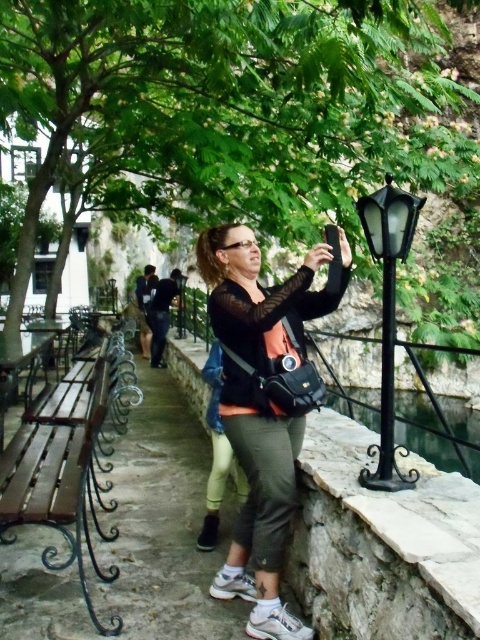
Is green fabric pants at center in front of black wrought iron lamp post at right?

Yes.

Measure the distance from green fabric pants at center to black wrought iron lamp post at right.

A distance of 1.67 meters exists between green fabric pants at center and black wrought iron lamp post at right.

Between point (2, 600) and point (408, 205), which one is positioned behind?

Point (2, 600)

Image resolution: width=480 pixels, height=640 pixels. I want to click on green fabric pants at center, so click(x=163, y=525).

Between wooden bench at left and black wrought iron lamp post at right, which one has more height?

wooden bench at left

Between wooden bench at left and black wrought iron lamp post at right, which one appears on the left side from the viewer's perspective?

Positioned to the left is wooden bench at left.

Does point (133, 388) come closer to viewer compared to point (391, 433)?

No, (133, 388) is behind (391, 433).

The image size is (480, 640). I want to click on wooden bench at left, so click(66, 461).

In the scene shown: Is green leafy tree at upper center shorter than matte black camera at center?

In fact, green leafy tree at upper center may be taller than matte black camera at center.

Is green leafy tree at upper center to the left of matte black camera at center from the viewer's perspective?

Correct, you'll find green leafy tree at upper center to the left of matte black camera at center.

What do you see at coordinates (227, 108) in the screenshot?
I see `green leafy tree at upper center` at bounding box center [227, 108].

This screenshot has height=640, width=480. In order to click on green leafy tree at upper center in this screenshot , I will do `click(227, 108)`.